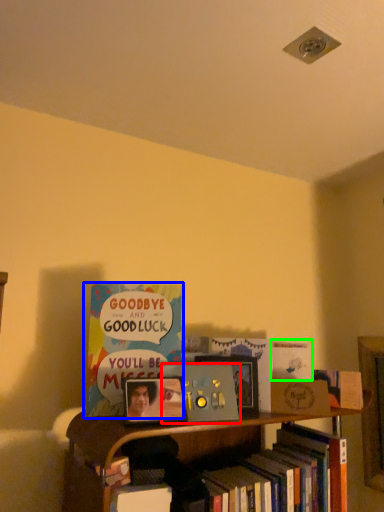
Question: Estimate the real-world distances between objects in this image. Which object is closer to book (highlighted by a red box), book (highlighted by a blue box) or book (highlighted by a green box)?

Choices:
 (A) book
 (B) book

Answer: (A)